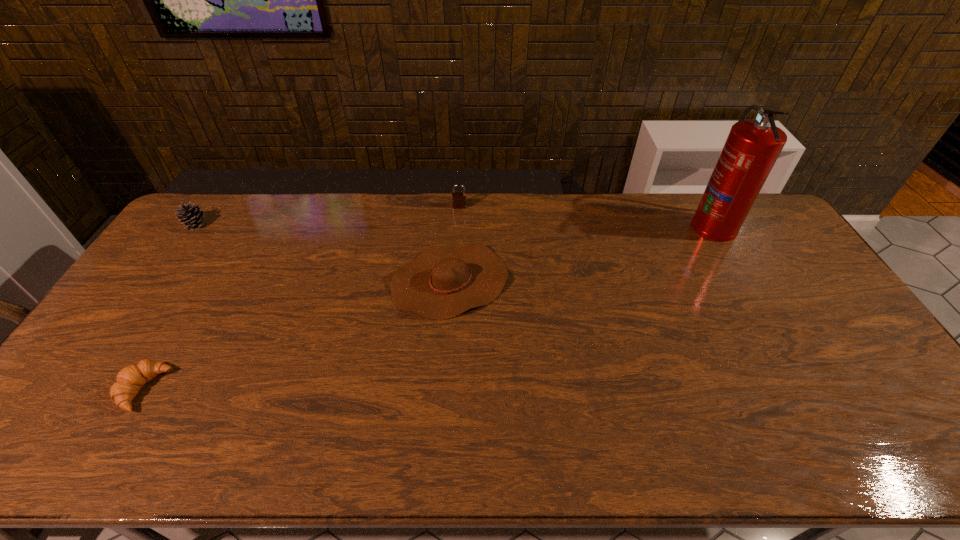
Where is `free space located on the instruction side of the tallest object`? free space located on the instruction side of the tallest object is located at coordinates (642, 226).

Where is `vacant position located on the front-facing side of the padlock`? The image size is (960, 540). vacant position located on the front-facing side of the padlock is located at coordinates (459, 217).

Locate an element on the screen. Image resolution: width=960 pixels, height=540 pixels. vacant space located 0.390m on the right of the leftmost object is located at coordinates (319, 225).

Identify the location of free space located 0.390m on the right of the fourth farthest object. Image resolution: width=960 pixels, height=540 pixels. (634, 281).

Find the location of a particular element. blank space located 0.070m on the right of the shortest object is located at coordinates (194, 389).

Identify the location of fire extinguisher at the far edge. (752, 147).

I want to click on padlock that is at the far edge, so click(458, 199).

Identify the location of pinecone positioned at the far edge. This screenshot has width=960, height=540. (193, 217).

This screenshot has width=960, height=540. I want to click on pinecone that is at the left edge, so click(193, 217).

Find the location of `crescent roll located in the left edge section of the desktop`. crescent roll located in the left edge section of the desktop is located at coordinates (130, 379).